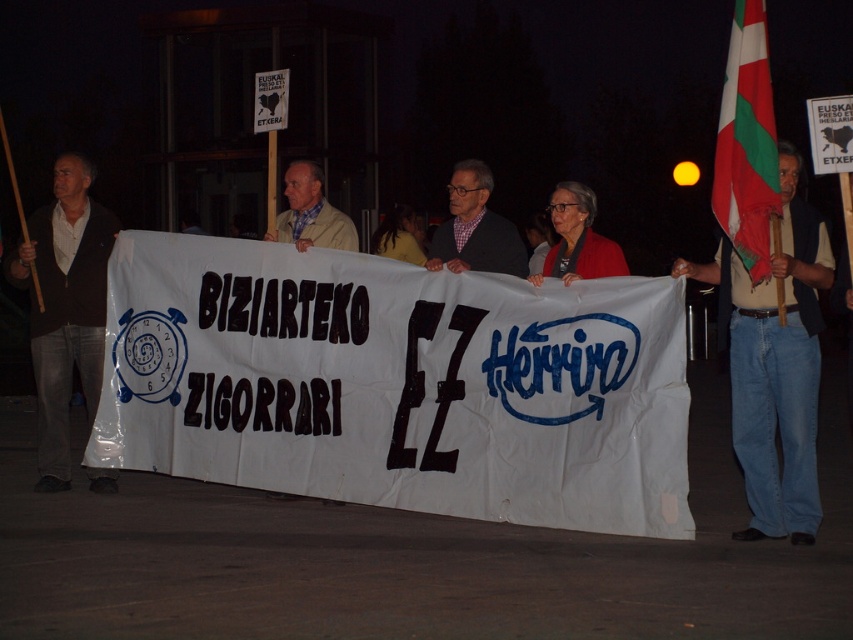
You are a photographer at the protest scene. You need to capture a photo that includes both the dark brown leather jacket at left and the checkered fabric shirt at center. Based on their positions, which direction should you move to ensure both are in frame?

You should move to the right so that both the dark brown leather jacket at left and the checkered fabric shirt at center are visible in the frame. Since the dark brown leather jacket at left is positioned to the left of the checkered fabric shirt at center, moving right will allow you to capture both in the shot.

You are a photographer trying to capture a clear photo of both the denim jeans at center and the checkered fabric shirt at center. The camera you have can focus on objects within a 5 feet range. Will you be able to capture both subjects in focus at the same time?

The denim jeans at center is 5.90 feet away from the checkered fabric shirt at center. Since the camera can only focus within 5 feet, the distance between them exceeds the focus range, so both cannot be in focus simultaneously.

You are a photographer trying to capture a clear photo of the protesters holding the banner. You need to focus on both the denim jeans at center and the checkered fabric shirt at center. Which object should you focus on first to ensure both are in focus?

You should focus on the denim jeans at center first since it is in front of the checkered fabric shirt at center, ensuring both will be in focus when starting with the closer object.